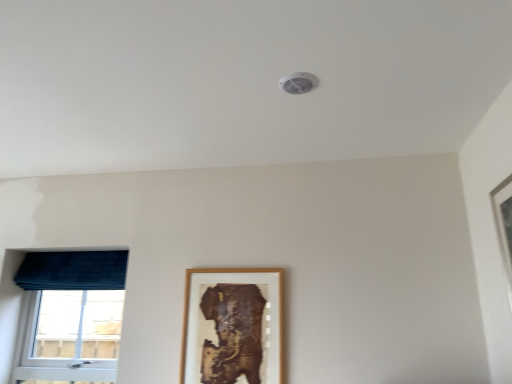
Question: In terms of width, does wooden picture frame at center look wider or thinner when compared to velvet blue window at left?

Choices:
 (A) thin
 (B) wide

Answer: (A)

Question: From the image's perspective, is wooden picture frame at center positioned above or below velvet blue window at left?

Choices:
 (A) above
 (B) below

Answer: (A)

Question: Which object is the closest to the velvet blue window at left?

Choices:
 (A) wooden picture frame at center
 (B) velvet blue curtain at left

Answer: (B)

Question: Estimate the real-world distances between objects in this image. Which object is farther from the velvet blue window at left?

Choices:
 (A) velvet blue curtain at left
 (B) wooden picture frame at center

Answer: (B)